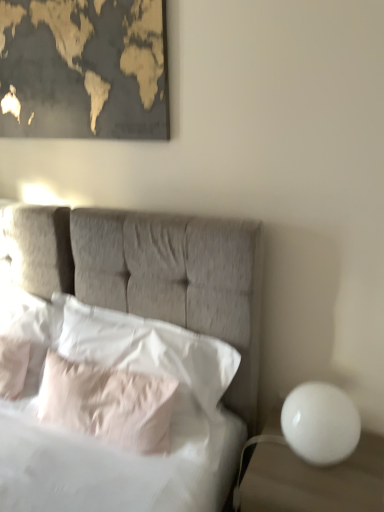
Question: Is pale pink fabric pillow at center, which is counted as the third pillow, starting from the left, positioned before white soft pillow at center, the 1th pillow viewed from the right?

Choices:
 (A) yes
 (B) no

Answer: (B)

Question: Is pale pink fabric pillow at center, which is counted as the third pillow, starting from the left, located outside white soft pillow at center, the 1th pillow viewed from the right?

Choices:
 (A) no
 (B) yes

Answer: (A)

Question: From a real-world perspective, is pale pink fabric pillow at center, the second pillow when ordered from right to left, positioned under white soft pillow at center, the 1th pillow viewed from the right, based on gravity?

Choices:
 (A) yes
 (B) no

Answer: (A)

Question: From the image's perspective, does pale pink fabric pillow at center, the second pillow when ordered from right to left, appear lower than white soft pillow at center, which appears as the 4th pillow when viewed from the left?

Choices:
 (A) yes
 (B) no

Answer: (A)

Question: Is pale pink fabric pillow at center, the second pillow when ordered from right to left, in contact with white soft pillow at center, the 1th pillow viewed from the right?

Choices:
 (A) no
 (B) yes

Answer: (A)

Question: Does pale pink fabric pillow at center, which is counted as the third pillow, starting from the left, have a larger size compared to white soft pillow at center, the 1th pillow viewed from the right?

Choices:
 (A) no
 (B) yes

Answer: (A)

Question: Is white soft pillow at left, which appears as the 3th pillow when viewed from the right, closer to the viewer compared to white soft pillow at left, positioned as the first pillow in left-to-right order?

Choices:
 (A) yes
 (B) no

Answer: (B)

Question: Considering the relative sizes of white soft pillow at left, which appears as the 3th pillow when viewed from the right, and white soft pillow at left, positioned as the first pillow in left-to-right order, in the image provided, is white soft pillow at left, which appears as the 3th pillow when viewed from the right, shorter than white soft pillow at left, positioned as the first pillow in left-to-right order,?

Choices:
 (A) no
 (B) yes

Answer: (B)

Question: Does white soft pillow at left, which appears as the 3th pillow when viewed from the right, have a smaller size compared to white soft pillow at left, positioned as the first pillow in left-to-right order?

Choices:
 (A) no
 (B) yes

Answer: (B)

Question: From a real-world perspective, is white soft pillow at left, which ranks as the second pillow in left-to-right order, on white soft pillow at left, acting as the fourth pillow starting from the right?

Choices:
 (A) yes
 (B) no

Answer: (B)

Question: Is white soft pillow at left, which ranks as the second pillow in left-to-right order, facing away from white soft pillow at left, positioned as the first pillow in left-to-right order?

Choices:
 (A) yes
 (B) no

Answer: (A)

Question: Is the depth of white soft pillow at left, which ranks as the second pillow in left-to-right order, greater than that of white soft pillow at left, acting as the fourth pillow starting from the right?

Choices:
 (A) yes
 (B) no

Answer: (A)

Question: Could you tell me if white glossy sphere at right is facing gold-toned matte map at upper left?

Choices:
 (A) no
 (B) yes

Answer: (A)